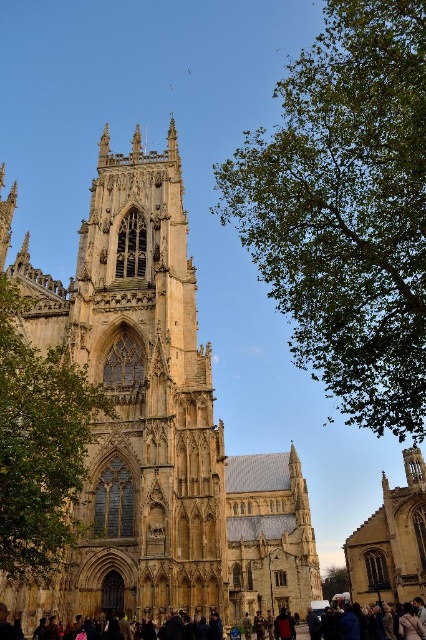
Question: Among these points, which one is farthest from the camera?

Choices:
 (A) (417, 625)
 (B) (353, 22)

Answer: (A)

Question: Does green leafy tree at upper right appear on the left side of green leafy tree at lower right?

Choices:
 (A) no
 (B) yes

Answer: (B)

Question: Does green leafy tree at upper right appear under green leafy tree at left?

Choices:
 (A) yes
 (B) no

Answer: (B)

Question: Considering the real-world distances, which object is farthest from the green leafy tree at upper right?

Choices:
 (A) green leafy tree at lower right
 (B) green leafy tree at left
 (C) dark brown leather jacket at lower center
 (D) golden stone church at center

Answer: (A)

Question: Which point appears closest to the camera in this image?

Choices:
 (A) (339, 566)
 (B) (23, 560)
 (C) (213, 554)

Answer: (B)

Question: Considering the relative positions of golden stone church at center and dark brown leather jacket at lower center in the image provided, where is golden stone church at center located with respect to dark brown leather jacket at lower center?

Choices:
 (A) above
 (B) below

Answer: (A)